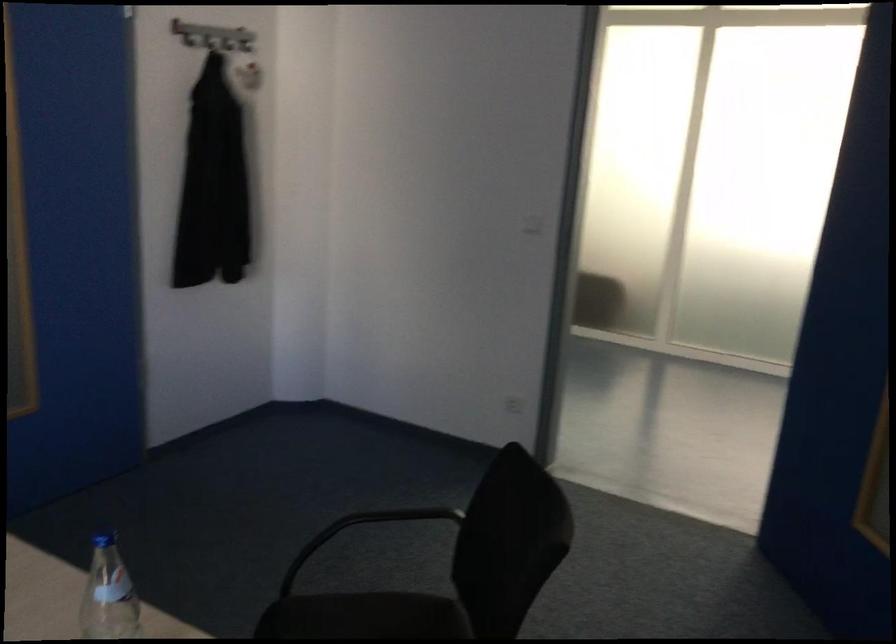
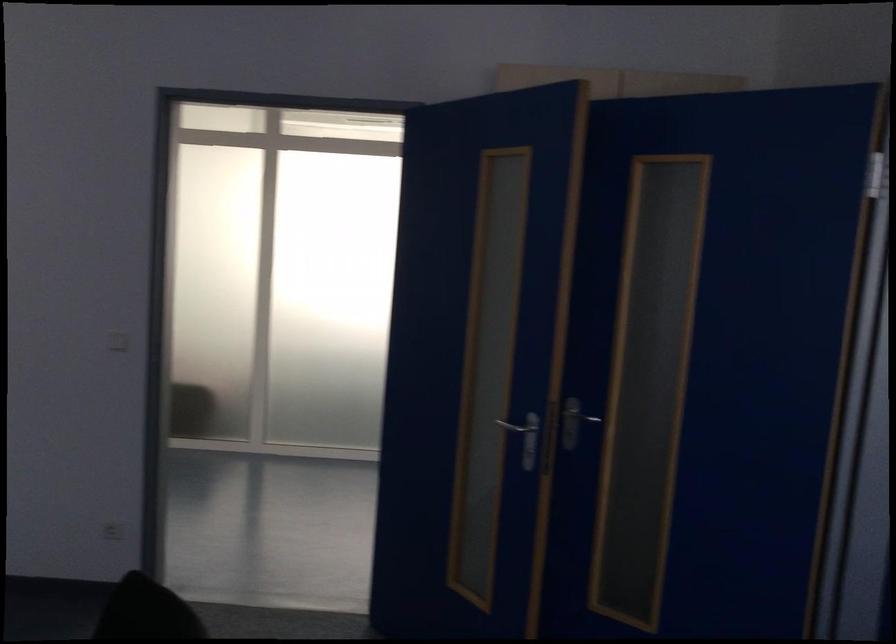
Find the pixel in the second image that matches pixel 502 400 in the first image.

(112, 531)